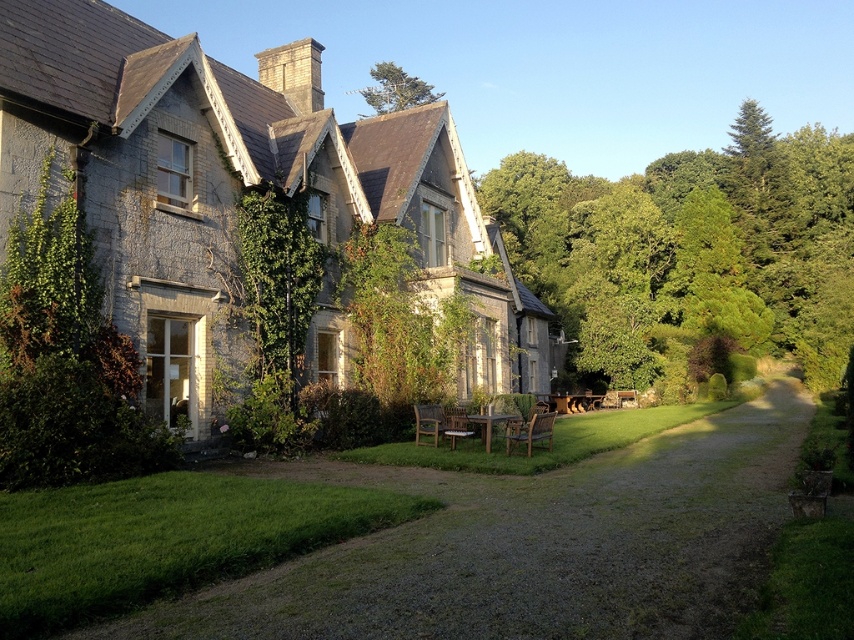
Question: Which object is closer to the camera taking this photo?

Choices:
 (A) green leafy tree at center
 (B) green leafy tree at right
 (C) stone cottage at center
 (D) gravel at center

Answer: (D)

Question: Which object is positioned closest to the green leafy tree at center?

Choices:
 (A) stone cottage at center
 (B) green leafy tree at upper center
 (C) gravel at center

Answer: (A)

Question: Observing the image, what is the correct spatial positioning of gravel at center in reference to green leafy tree at right?

Choices:
 (A) above
 (B) below

Answer: (B)

Question: Which is nearer to the green leafy tree at upper center?

Choices:
 (A) green leafy tree at center
 (B) gravel at center
 (C) stone cottage at center

Answer: (C)

Question: Is green leafy tree at right to the left of green leafy tree at upper center from the viewer's perspective?

Choices:
 (A) no
 (B) yes

Answer: (A)

Question: Is gravel at center wider than green leafy tree at upper center?

Choices:
 (A) no
 (B) yes

Answer: (A)